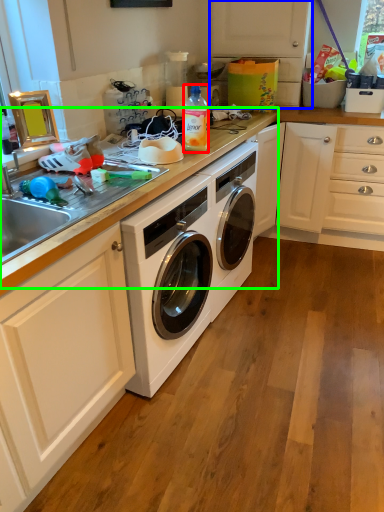
Question: Estimate the real-world distances between objects in this image. Which object is closer to bottle (highlighted by a red box), cabinetry (highlighted by a blue box) or counter top (highlighted by a green box)?

Choices:
 (A) cabinetry
 (B) counter top

Answer: (B)